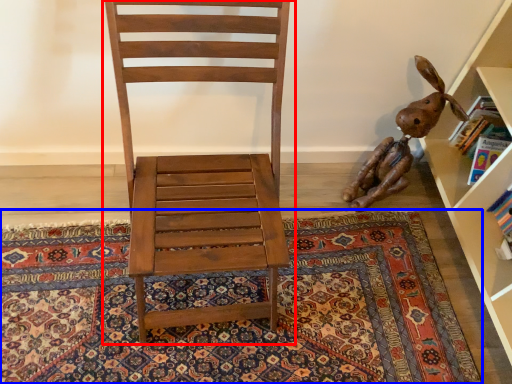
Question: Which object is further to the camera taking this photo, chair (highlighted by a red box) or mat (highlighted by a blue box)?

Choices:
 (A) chair
 (B) mat

Answer: (B)